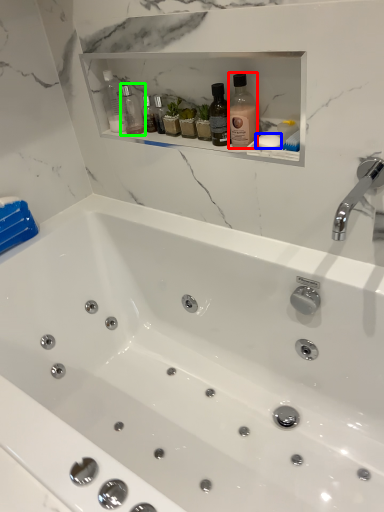
Question: Which is farther away from bottle (highlighted by a red box)? soap (highlighted by a blue box) or bottle (highlighted by a green box)?

Choices:
 (A) soap
 (B) bottle

Answer: (B)